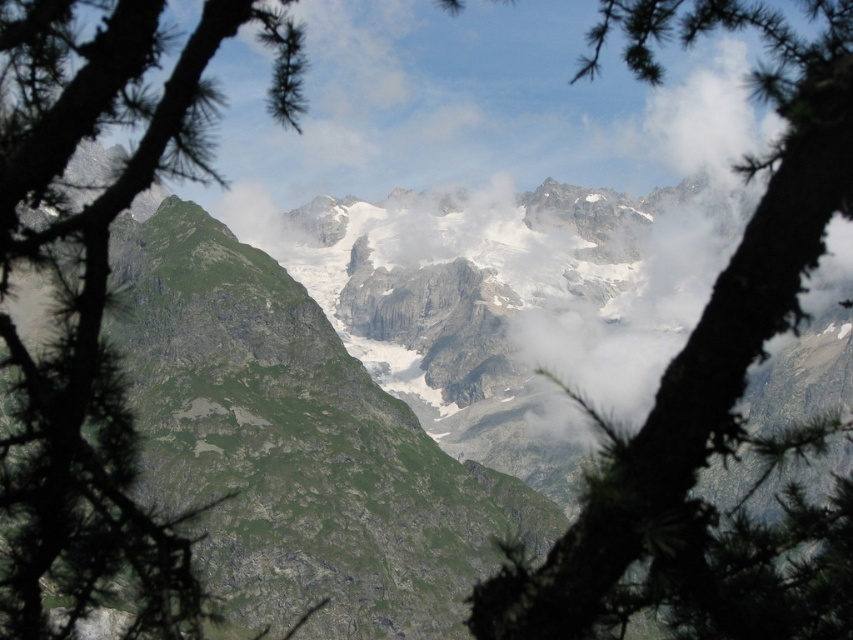
Is point (618, 637) farther from viewer compared to point (143, 140)?

That is False.

Between green textured branch at center and green needle-like branches at left, which one is positioned higher?

green textured branch at center is higher up.

Between point (473, 621) and point (68, 44), which one is positioned behind?

Point (68, 44)

Image resolution: width=853 pixels, height=640 pixels. Identify the location of green textured branch at center. (712, 390).